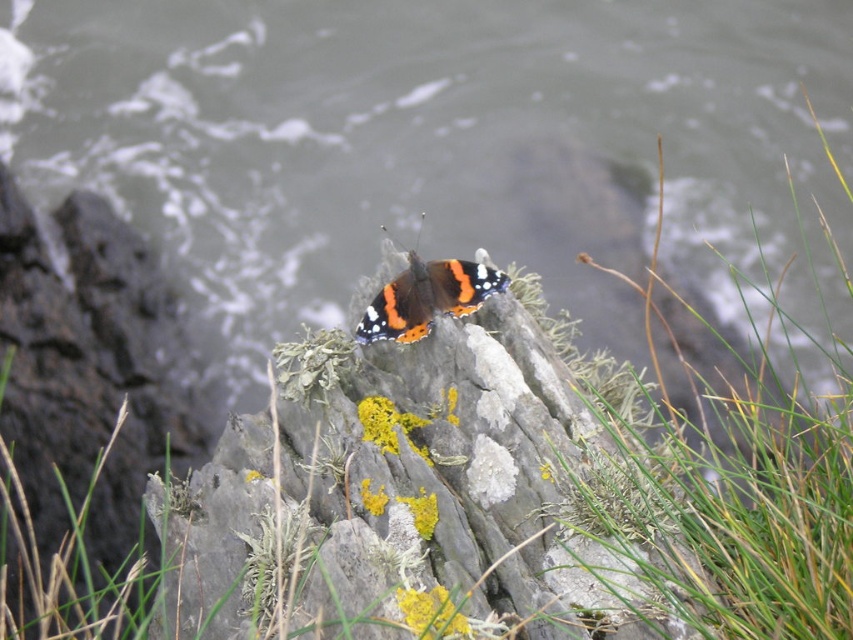
Describe the element at coordinates (399, 499) in the screenshot. I see `lichen-covered rock at center` at that location.

Is point (486, 497) closer to camera compared to point (479, 276)?

Yes, it is.

Find the location of a particular element. The width and height of the screenshot is (853, 640). lichen-covered rock at center is located at coordinates (399, 499).

This screenshot has width=853, height=640. In order to click on gray rough rock at center in this screenshot , I will do `click(83, 404)`.

Does gray rough rock at center have a larger size compared to shiny orange butterfly at center?

Yes.

Describe the element at coordinates (83, 404) in the screenshot. I see `gray rough rock at center` at that location.

Where is `gray rough rock at center`? This screenshot has height=640, width=853. gray rough rock at center is located at coordinates (83, 404).

Based on the photo, who is shorter, lichen-covered rock at center or gray rough rock at center?

Standing shorter between the two is lichen-covered rock at center.

Is point (230, 476) closer to viewer compared to point (39, 616)?

No, it is not.

The width and height of the screenshot is (853, 640). Find the location of `lichen-covered rock at center`. lichen-covered rock at center is located at coordinates (399, 499).